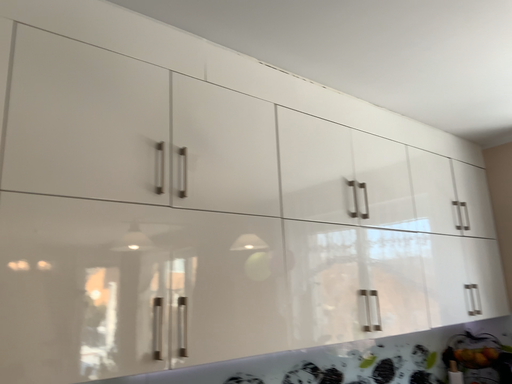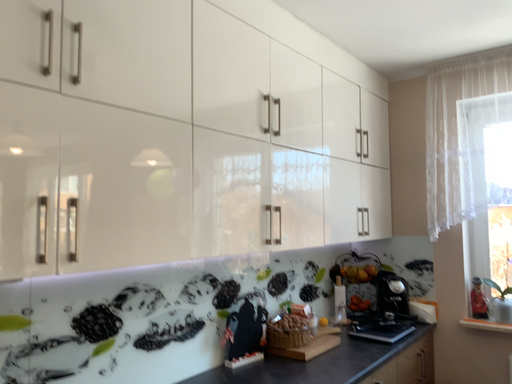
Question: How did the camera likely rotate when shooting the video?

Choices:
 (A) rotated upward
 (B) rotated downward

Answer: (B)